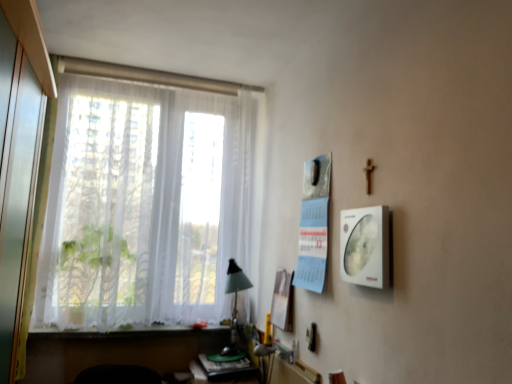
Question: Does white sheer curtains at left have a lesser height compared to white paper at center, which is counted as the 1th poster page, starting from the left?

Choices:
 (A) yes
 (B) no

Answer: (B)

Question: Is white sheer curtains at left with white paper at center, the 2th poster page from the top?

Choices:
 (A) yes
 (B) no

Answer: (B)

Question: From a real-world perspective, is white sheer curtains at left located higher than white paper at center, positioned as the first poster page in back-to-front order?

Choices:
 (A) yes
 (B) no

Answer: (A)

Question: Is white sheer curtains at left positioned far away from white paper at center, marked as the 1th poster page in a bottom-to-top arrangement?

Choices:
 (A) yes
 (B) no

Answer: (B)

Question: Considering the relative sizes of white sheer curtains at left and white paper at center, marked as the 1th poster page in a bottom-to-top arrangement, in the image provided, is white sheer curtains at left smaller than white paper at center, marked as the 1th poster page in a bottom-to-top arrangement,?

Choices:
 (A) no
 (B) yes

Answer: (A)

Question: Considering the relative sizes of white sheer curtains at left and white paper at center, acting as the second poster page starting from the front, in the image provided, is white sheer curtains at left thinner than white paper at center, acting as the second poster page starting from the front,?

Choices:
 (A) no
 (B) yes

Answer: (A)

Question: Can you confirm if white glossy picture frame at right is bigger than wooden table at lower center?

Choices:
 (A) no
 (B) yes

Answer: (A)

Question: Could you tell me if white glossy picture frame at right is turned towards wooden table at lower center?

Choices:
 (A) yes
 (B) no

Answer: (B)

Question: Is the position of white glossy picture frame at right less distant than that of wooden table at lower center?

Choices:
 (A) yes
 (B) no

Answer: (A)

Question: Is white glossy picture frame at right completely or partially outside of wooden table at lower center?

Choices:
 (A) no
 (B) yes

Answer: (B)

Question: Is white glossy picture frame at right far from wooden table at lower center?

Choices:
 (A) yes
 (B) no

Answer: (A)

Question: Considering the relative positions of white glossy picture frame at right and wooden table at lower center in the image provided, is white glossy picture frame at right behind wooden table at lower center?

Choices:
 (A) no
 (B) yes

Answer: (A)

Question: Does white paper at center, the 2th poster page from the top, have a lesser height compared to white matte window sill at lower left?

Choices:
 (A) no
 (B) yes

Answer: (A)